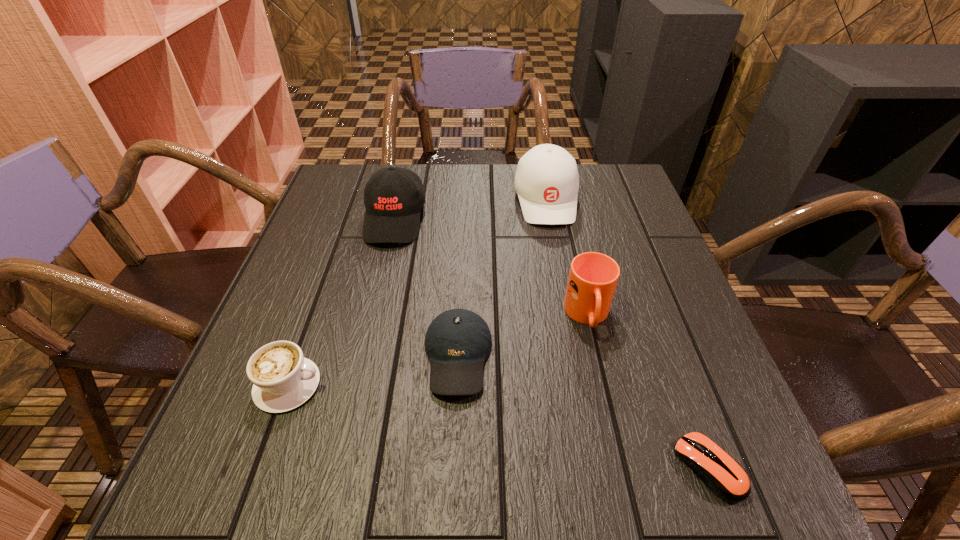
Find the location of `vacant space located on the handle side of the mug`. vacant space located on the handle side of the mug is located at coordinates (621, 459).

Locate an element on the screen. Image resolution: width=960 pixels, height=540 pixels. vacant space located to the right of the cappuccino's handle is located at coordinates (407, 385).

Locate an element on the screen. The width and height of the screenshot is (960, 540). vacant region located 0.170m on the front-facing side of the shortest baseball cap is located at coordinates (451, 509).

Image resolution: width=960 pixels, height=540 pixels. I want to click on vacant region located 0.370m on the left of the computer mouse, so click(x=438, y=468).

Identify the location of object positioned at the near edge. Image resolution: width=960 pixels, height=540 pixels. (722, 474).

This screenshot has height=540, width=960. I want to click on baseball cap located in the left edge section of the desktop, so click(393, 197).

Locate an element on the screen. This screenshot has height=540, width=960. cappuccino that is at the left edge is located at coordinates [x=282, y=378].

Locate an element on the screen. The image size is (960, 540). object positioned at the right edge is located at coordinates (722, 474).

You are a GUI agent. You are given a task and a screenshot of the screen. Output one action in this format:
    pyautogui.click(x=<x>, y=<y>)
    Task: Click on the object present at the far left corner
    Image resolution: width=960 pixels, height=540 pixels.
    Given the screenshot: What is the action you would take?
    click(393, 197)

Locate an element on the screen. The image size is (960, 540). object located in the near right corner section of the desktop is located at coordinates (722, 474).